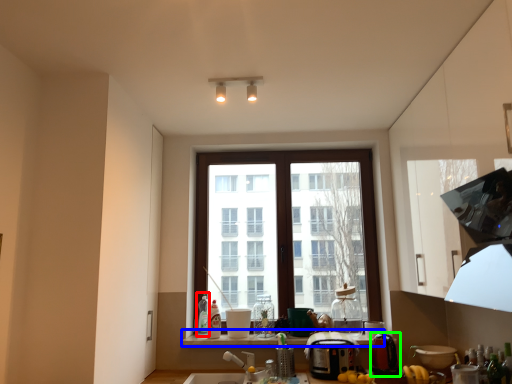
Question: Which object is the farthest from bottle (highlighted by a red box)? Choose among these: window sill (highlighted by a blue box) or appliance (highlighted by a green box).

Choices:
 (A) window sill
 (B) appliance

Answer: (B)